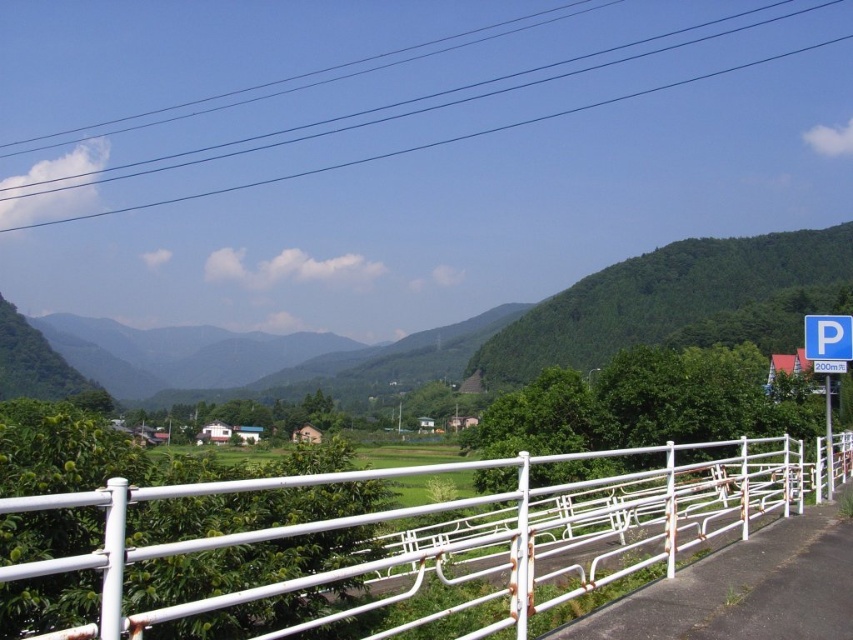
Question: Estimate the real-world distances between objects in this image. Which object is closer to the blue plastic parking sign at right?

Choices:
 (A) white metal fence at center
 (B) green leafy mountain at center

Answer: (A)

Question: Does white metal fence at center appear over green leafy mountain at center?

Choices:
 (A) yes
 (B) no

Answer: (B)

Question: In this image, where is white metal fence at center located relative to blue plastic parking sign at right?

Choices:
 (A) right
 (B) left

Answer: (B)

Question: Which of these objects is positioned farthest from the white metal fence at center?

Choices:
 (A) blue plastic parking sign at right
 (B) green leafy mountain at center

Answer: (B)

Question: Can you confirm if white metal fence at center is positioned below green leafy mountain at center?

Choices:
 (A) yes
 (B) no

Answer: (A)

Question: Based on their relative distances, which object is nearer to the white metal fence at center?

Choices:
 (A) blue plastic parking sign at right
 (B) green leafy mountain at center

Answer: (A)